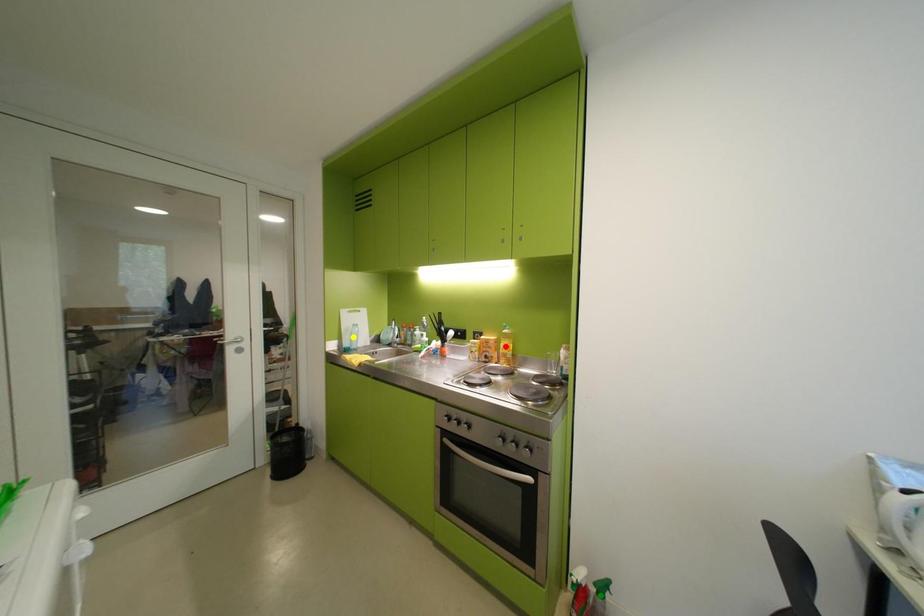
Order these from nearest to farthest:
yellow point, green point, red point

1. green point
2. red point
3. yellow point